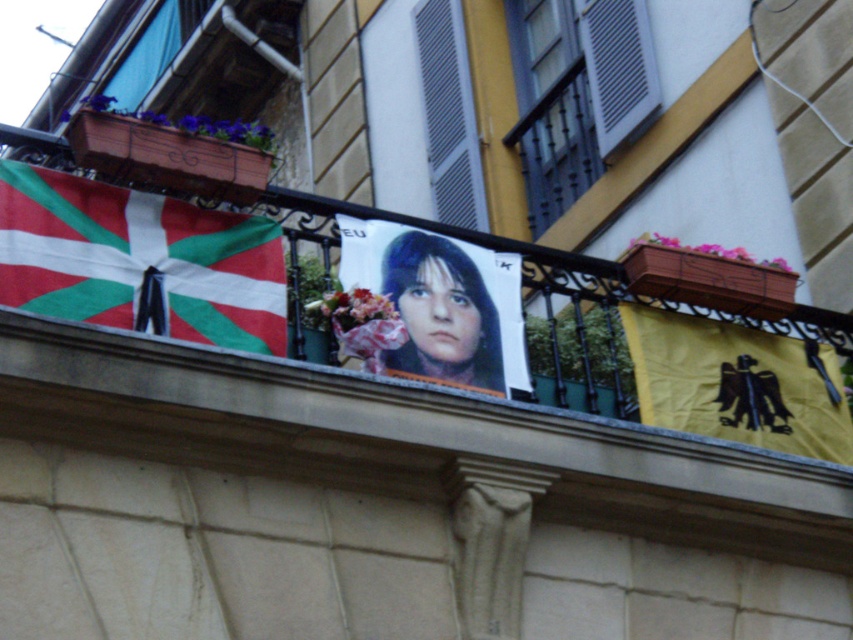
Between red and green fabric flag at left and yellow fabric eagle at right, which one appears on the left side from the viewer's perspective?

From the viewer's perspective, red and green fabric flag at left appears more on the left side.

Who is taller, red and green fabric flag at left or yellow fabric eagle at right?

Standing taller between the two is red and green fabric flag at left.

Is point (186, 339) positioned in front of point (775, 412)?

Yes, it is.

Where is `red and green fabric flag at left`? red and green fabric flag at left is located at coordinates (138, 260).

Can you confirm if matte paper poster at center is taller than smooth paper portrait at center?

Indeed, matte paper poster at center has a greater height compared to smooth paper portrait at center.

The width and height of the screenshot is (853, 640). I want to click on matte paper poster at center, so click(412, 438).

Which is in front, point (834, 394) or point (459, 337)?

Positioned in front is point (459, 337).

Is yellow fabric eagle at right taller than smooth paper portrait at center?

Correct, yellow fabric eagle at right is much taller as smooth paper portrait at center.

The image size is (853, 640). Identify the location of yellow fabric eagle at right. (737, 384).